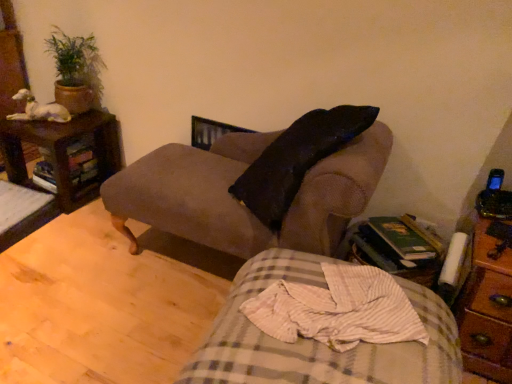
Question: Is brown wooden nightstand at left, which is the second nightstand in front-to-back order, touching plaid fabric bed at lower center?

Choices:
 (A) yes
 (B) no

Answer: (B)

Question: From a real-world perspective, is brown wooden nightstand at left, arranged as the second nightstand when ordered from the bottom, physically above plaid fabric bed at lower center?

Choices:
 (A) no
 (B) yes

Answer: (A)

Question: Considering the relative positions of brown wooden nightstand at left, placed as the first nightstand when sorted from back to front, and plaid fabric bed at lower center in the image provided, is brown wooden nightstand at left, placed as the first nightstand when sorted from back to front, to the left of plaid fabric bed at lower center from the viewer's perspective?

Choices:
 (A) no
 (B) yes

Answer: (B)

Question: Would you say brown wooden nightstand at left, which is counted as the second nightstand, starting from the right, is outside plaid fabric bed at lower center?

Choices:
 (A) no
 (B) yes

Answer: (B)

Question: Is brown wooden nightstand at left, which is the second nightstand in front-to-back order, oriented away from plaid fabric bed at lower center?

Choices:
 (A) no
 (B) yes

Answer: (A)

Question: From a real-world perspective, relative to brown wooden nightstand at left, which is counted as the second nightstand, starting from the right, is suede-like brown couch at center vertically above or below?

Choices:
 (A) below
 (B) above

Answer: (B)

Question: Is suede-like brown couch at center spatially inside brown wooden nightstand at left, the 1th nightstand in the top-to-bottom sequence, or outside of it?

Choices:
 (A) inside
 (B) outside

Answer: (B)

Question: Looking at their shapes, would you say suede-like brown couch at center is wider or thinner than brown wooden nightstand at left, which is counted as the second nightstand, starting from the right?

Choices:
 (A) wide
 (B) thin

Answer: (A)

Question: Looking at the image, does suede-like brown couch at center seem bigger or smaller compared to brown wooden nightstand at left, arranged as the second nightstand when ordered from the bottom?

Choices:
 (A) small
 (B) big

Answer: (B)

Question: From a real-world perspective, relative to plaid fabric bed at lower center, is wooden side table at lower right vertically above or below?

Choices:
 (A) above
 (B) below

Answer: (A)

Question: From the image's perspective, relative to plaid fabric bed at lower center, is wooden side table at lower right above or below?

Choices:
 (A) above
 (B) below

Answer: (A)

Question: Would you say wooden side table at lower right is to the left or to the right of plaid fabric bed at lower center in the picture?

Choices:
 (A) right
 (B) left

Answer: (A)

Question: Is point (365, 236) positioned closer to the camera than point (245, 339)?

Choices:
 (A) closer
 (B) farther

Answer: (B)

Question: Considering the positions of brown wooden nightstand at right, placed as the second nightstand when sorted from top to bottom, and white matte statue at upper left in the image, is brown wooden nightstand at right, placed as the second nightstand when sorted from top to bottom, wider or thinner than white matte statue at upper left?

Choices:
 (A) wide
 (B) thin

Answer: (A)

Question: From a real-world perspective, relative to white matte statue at upper left, is brown wooden nightstand at right, placed as the first nightstand when sorted from front to back, vertically above or below?

Choices:
 (A) above
 (B) below

Answer: (B)